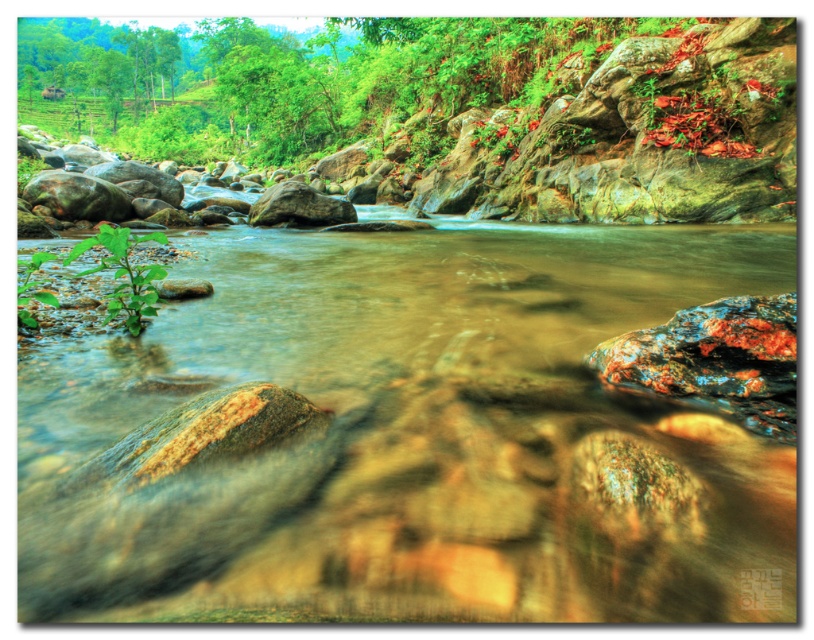
In the scene shown: Which is below, green leafy plant at left or green leafy plant at lower left?

Positioned lower is green leafy plant at lower left.

Is green leafy plant at left behind green leafy plant at lower left?

No, green leafy plant at left is in front of green leafy plant at lower left.

What do you see at coordinates (125, 275) in the screenshot? I see `green leafy plant at left` at bounding box center [125, 275].

The height and width of the screenshot is (640, 814). In order to click on green leafy plant at left in this screenshot , I will do `click(125, 275)`.